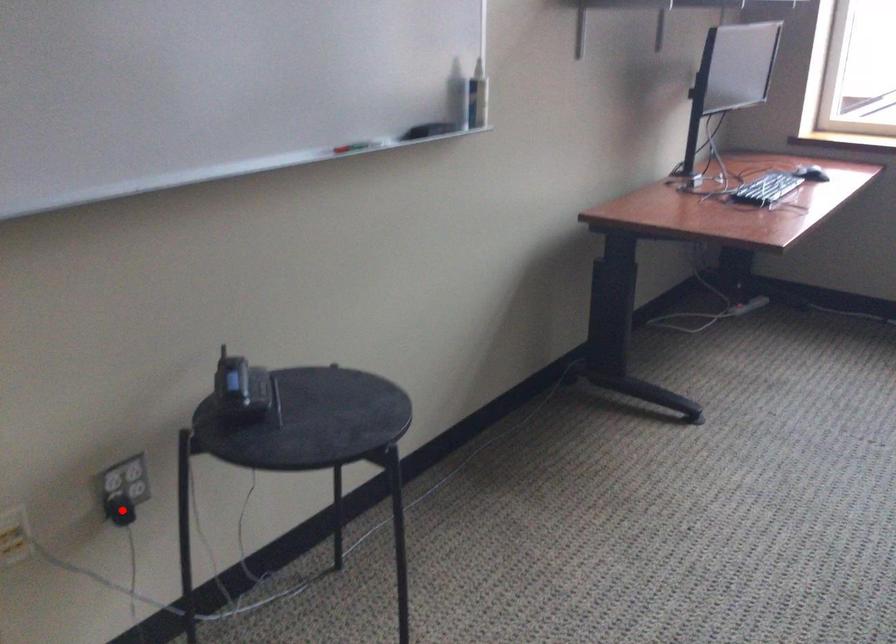
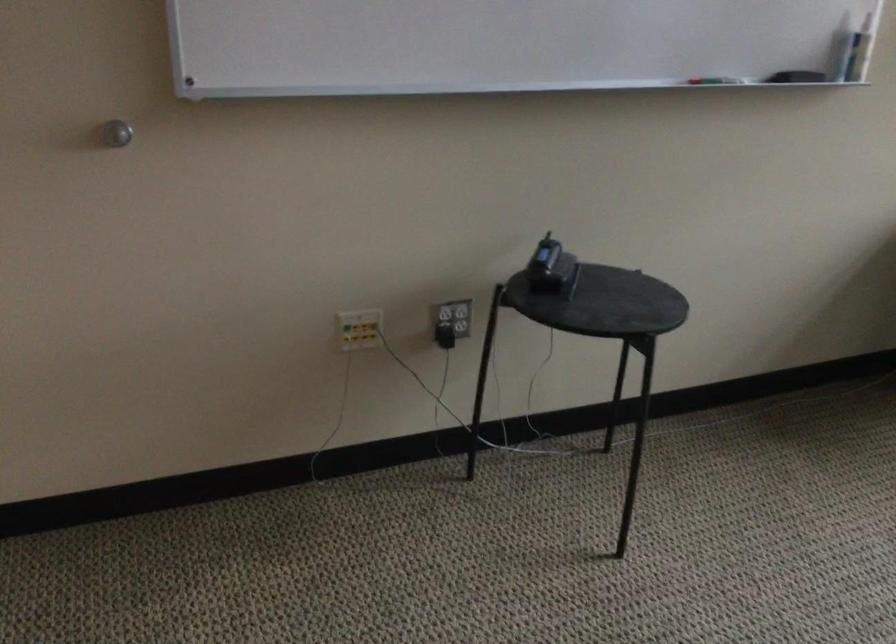
Locate, in the second image, the point that corresponds to the highlighted location in the first image.

(444, 336)